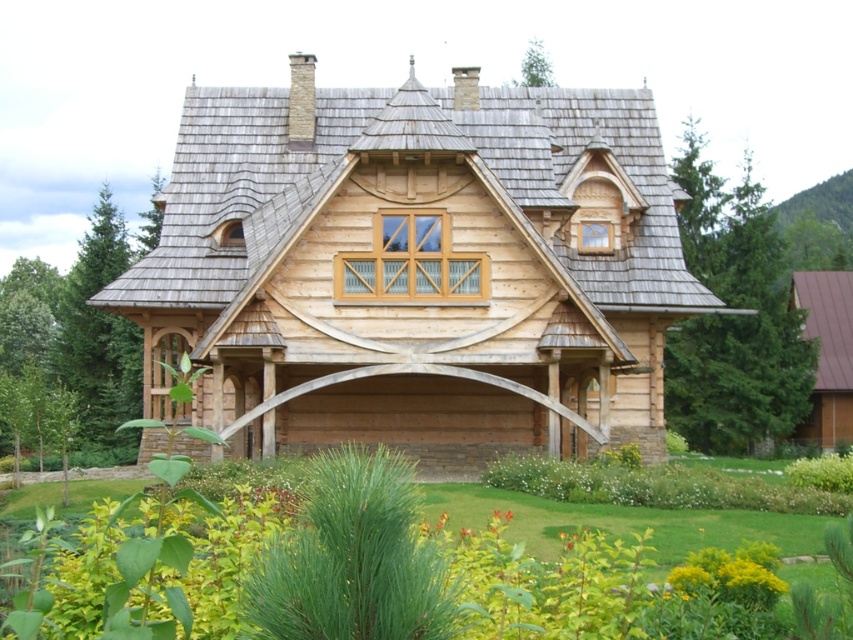
Does metallic brown roof at right have a smaller size compared to yellow-green foliage at lower center?

Incorrect, metallic brown roof at right is not smaller in size than yellow-green foliage at lower center.

Measure the distance between metallic brown roof at right and camera.

metallic brown roof at right and camera are 368.22 feet apart.

Is point (828, 420) closer to viewer compared to point (747, 557)?

No, (828, 420) is further to viewer.

Find the location of a particular element. metallic brown roof at right is located at coordinates (827, 353).

Where is `green leafy plants at lower center`? The height and width of the screenshot is (640, 853). green leafy plants at lower center is located at coordinates (x=355, y=570).

Which is behind, point (131, 554) or point (688, 561)?

The point (688, 561) is behind.

Locate an element on the screen. The width and height of the screenshot is (853, 640). green leafy plants at lower center is located at coordinates [x=355, y=570].

How distant is natural wood cottage at center from metallic brown roof at right?

natural wood cottage at center and metallic brown roof at right are 64.51 meters apart from each other.

Between natural wood cottage at center and metallic brown roof at right, which one has more height?

Standing taller between the two is natural wood cottage at center.

Image resolution: width=853 pixels, height=640 pixels. Find the location of `natural wood cottage at center`. natural wood cottage at center is located at coordinates (416, 268).

Where is `natural wood cottage at center`? natural wood cottage at center is located at coordinates (416, 268).